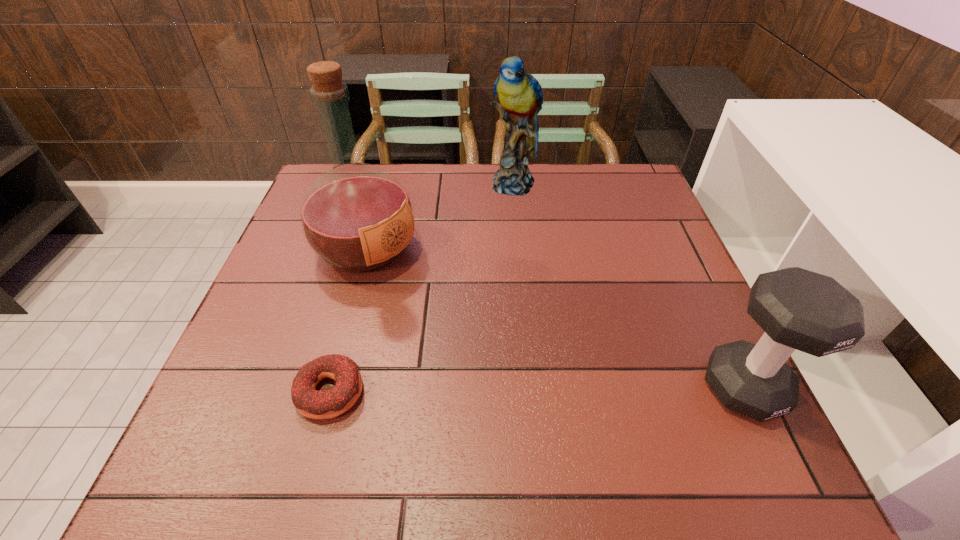
Image resolution: width=960 pixels, height=540 pixels. Find the location of `free spot on the desktop that is between the shortest object and the second shortest object and is positioned on the front label of the liquor`. free spot on the desktop that is between the shortest object and the second shortest object and is positioned on the front label of the liquor is located at coordinates (592, 389).

Find the location of `vacant space on the desktop that is between the shortest object and the rightmost object and is positioned on the face of the parrot`. vacant space on the desktop that is between the shortest object and the rightmost object and is positioned on the face of the parrot is located at coordinates (520, 390).